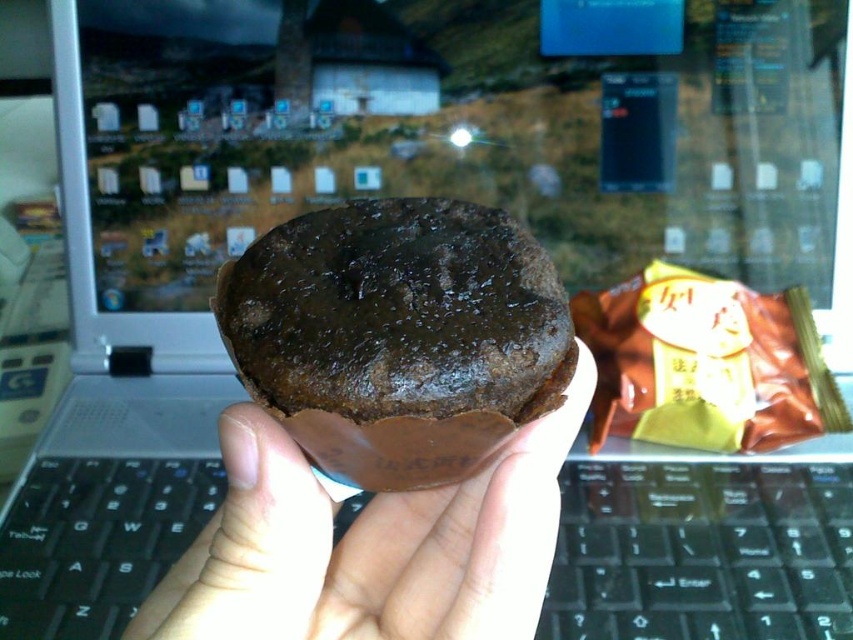
Is black plastic keyboard at center shorter than chocolate matte cake at center?

Correct, black plastic keyboard at center is not as tall as chocolate matte cake at center.

Can you confirm if black plastic keyboard at center is smaller than chocolate matte cake at center?

Actually, black plastic keyboard at center might be larger than chocolate matte cake at center.

You are a GUI agent. You are given a task and a screenshot of the screen. Output one action in this format:
    pyautogui.click(x=<x>, y=<y>)
    Task: Click on the black plastic keyboard at center
    The width and height of the screenshot is (853, 640).
    Given the screenshot: What is the action you would take?
    pyautogui.click(x=701, y=552)

Does point (401, 460) come in front of point (405, 540)?

Yes.

From the picture: Between chocolate matte cake at center and brown matte cupcake at center, which one appears on the right side from the viewer's perspective?

Positioned to the right is chocolate matte cake at center.

Based on the photo, who is more distant from viewer, [445,268] or [287,454]?

The point [445,268] is more distant.

Find the location of a particular element. chocolate matte cake at center is located at coordinates (397, 336).

Is black plastic keyboard at center behind brown matte cupcake at center?

That is True.

In the scene shown: Does black plastic keyboard at center have a lesser width compared to brown matte cupcake at center?

No.

Is point (135, 547) positioned behind point (498, 508)?

Yes, it is.

Find the location of a particular element. The width and height of the screenshot is (853, 640). black plastic keyboard at center is located at coordinates (701, 552).